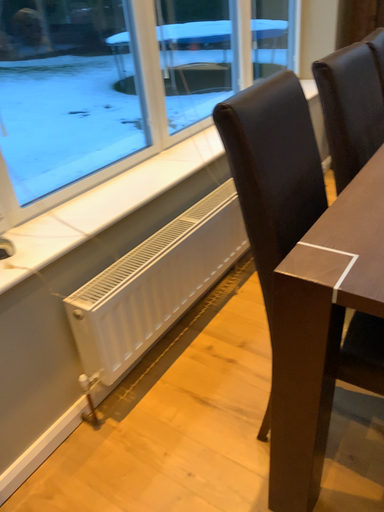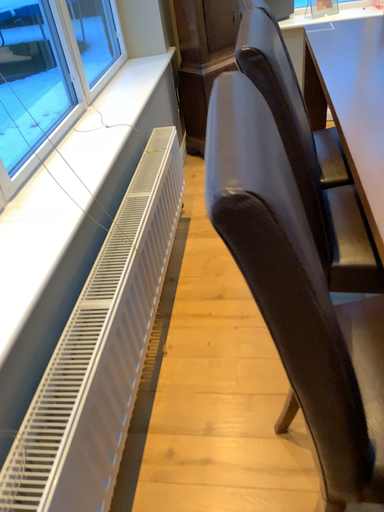
Question: How did the camera likely rotate when shooting the video?

Choices:
 (A) rotated right
 (B) rotated left

Answer: (A)